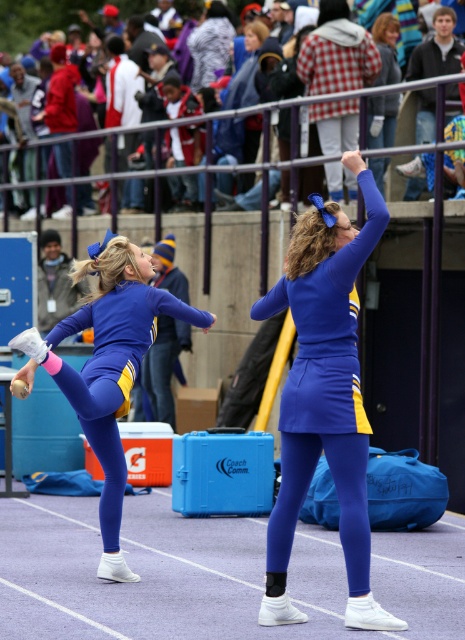
Question: Which of the following is the closest to the observer?

Choices:
 (A) (105, 388)
 (B) (90, 140)
 (C) (400, 621)

Answer: (C)

Question: Is blue fabric cheerleader at center behind plaid fabric jacket at upper center?

Choices:
 (A) yes
 (B) no

Answer: (B)

Question: Which object is positioned farthest from the matte blue uniform at center?

Choices:
 (A) plaid fabric jacket at upper center
 (B) blue fabric cheerleader at center

Answer: (A)

Question: From the image, what is the correct spatial relationship of matte blue uniform at center in relation to plaid fabric jacket at upper center?

Choices:
 (A) right
 (B) left

Answer: (A)

Question: Is blue fabric cheerleader at center smaller than matte blue uniform at center?

Choices:
 (A) no
 (B) yes

Answer: (B)

Question: Which is farther from the plaid fabric jacket at upper center?

Choices:
 (A) matte blue uniform at center
 (B) blue fabric cheerleader at center

Answer: (B)